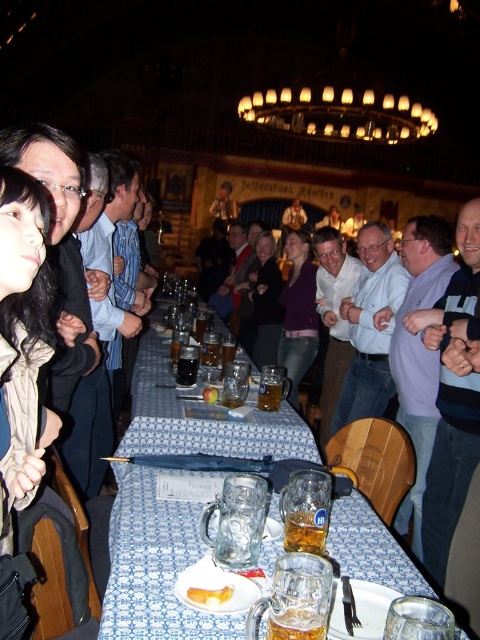
You are a server in the beer hall and need to place a new plate of food between the translucent glass mug at center and the yellowish matte bread at lower center. The plate is 5 inches in diameter. Is there enough space between them to place the plate without moving either item?

The distance between the translucent glass mug at center and the yellowish matte bread at lower center is 10.80 inches. Since the plate is 5 inches in diameter, there is sufficient space to place it between them without moving either item.

Looking at this image, you are a server at the beer hall and need to place a new order of bread on the table. The bread should be placed to the right of the clear glass mugs at center. Where should you place the bread in relation to the existing yellowish matte bread at lower center?

The clear glass mugs at center are already to the left of the yellowish matte bread at lower center, so placing the new bread to the right of the clear glass mugs at center would mean placing it to the right of the existing yellowish matte bread at lower center.

Consider the image. You are a server in the beer hall and need to place a new tray of drinks on the table without knocking over any existing items. The tray is 10 cm tall. Considering the clear glass mugs at center and the yellowish matte bread at lower center, which item might pose a greater risk of tipping over if the tray is placed nearby?

The clear glass mugs at center are much taller than the yellowish matte bread at lower center, so they are more likely to tip over if the tray is placed nearby.